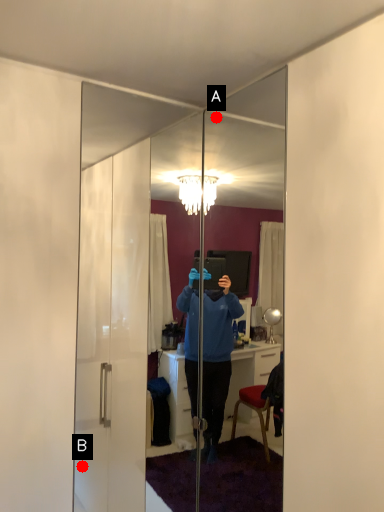
Question: Two points are circled on the image, labeled by A and B beside each circle. Which point is farther from the camera taking this photo?

Choices:
 (A) A is further
 (B) B is further

Answer: (B)